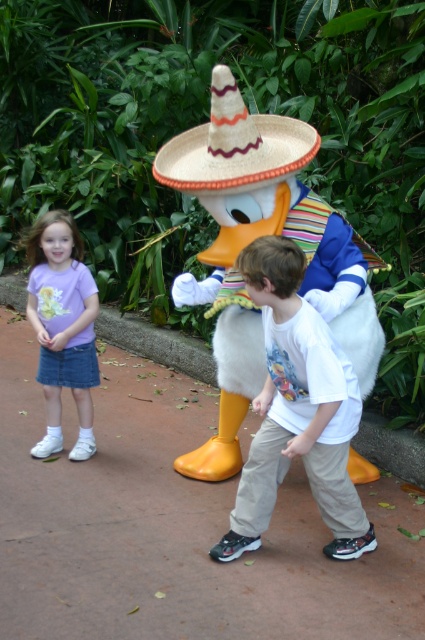
Question: Is white plush duck at center below purple cotton shirt at left?

Choices:
 (A) yes
 (B) no

Answer: (B)

Question: Which object appears closest to the camera in this image?

Choices:
 (A) straw sombrero at center
 (B) white cotton shirt at center
 (C) purple cotton shirt at left
 (D) white plush duck at center

Answer: (B)

Question: Which is nearer to the white cotton shirt at center?

Choices:
 (A) straw sombrero at center
 (B) purple cotton shirt at left
 (C) white plush duck at center

Answer: (C)

Question: Which of the following is the closest to the observer?

Choices:
 (A) (237, 180)
 (B) (81, 426)
 (C) (223, 330)
 (D) (272, 362)

Answer: (D)

Question: Is white cotton shirt at center to the right of purple cotton shirt at left from the viewer's perspective?

Choices:
 (A) yes
 (B) no

Answer: (A)

Question: Can you confirm if white cotton shirt at center is thinner than purple cotton shirt at left?

Choices:
 (A) yes
 (B) no

Answer: (B)